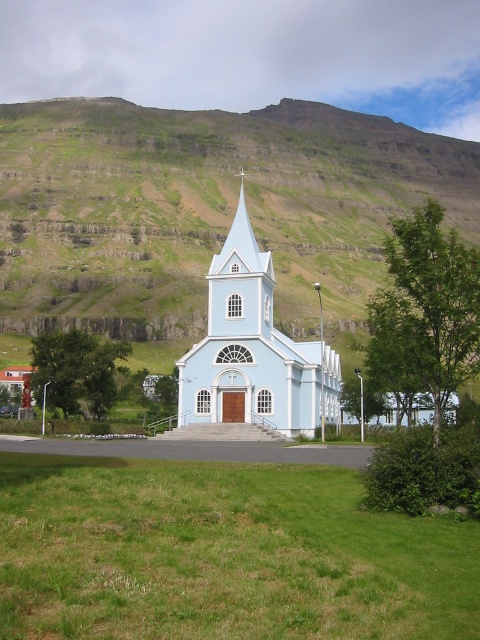
The height and width of the screenshot is (640, 480). Identify the location of green grass at lower left. (222, 554).

I want to click on green grass at lower left, so click(222, 554).

Is green grassy hillside at upper center wider than green grass at lower left?

Correct, the width of green grassy hillside at upper center exceeds that of green grass at lower left.

Is green grassy hillside at upper center to the left of green grass at lower left from the viewer's perspective?

Indeed, green grassy hillside at upper center is positioned on the left side of green grass at lower left.

I want to click on green grassy hillside at upper center, so click(204, 208).

Between green grassy hillside at upper center and light blue painted wood church at center, which one is positioned lower?

light blue painted wood church at center is below.

The height and width of the screenshot is (640, 480). Describe the element at coordinates (204, 208) in the screenshot. I see `green grassy hillside at upper center` at that location.

At what (x,y) coordinates should I click in order to perform the action: click on green grassy hillside at upper center. Please return your answer as a coordinate pair (x, y). The image size is (480, 640). Looking at the image, I should click on (204, 208).